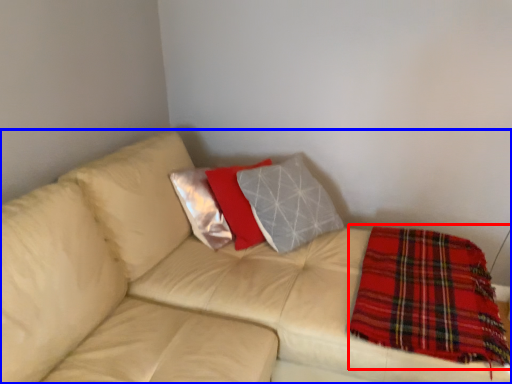
Question: Which object is further to the camera taking this photo, blanket (highlighted by a red box) or studio couch (highlighted by a blue box)?

Choices:
 (A) blanket
 (B) studio couch

Answer: (A)